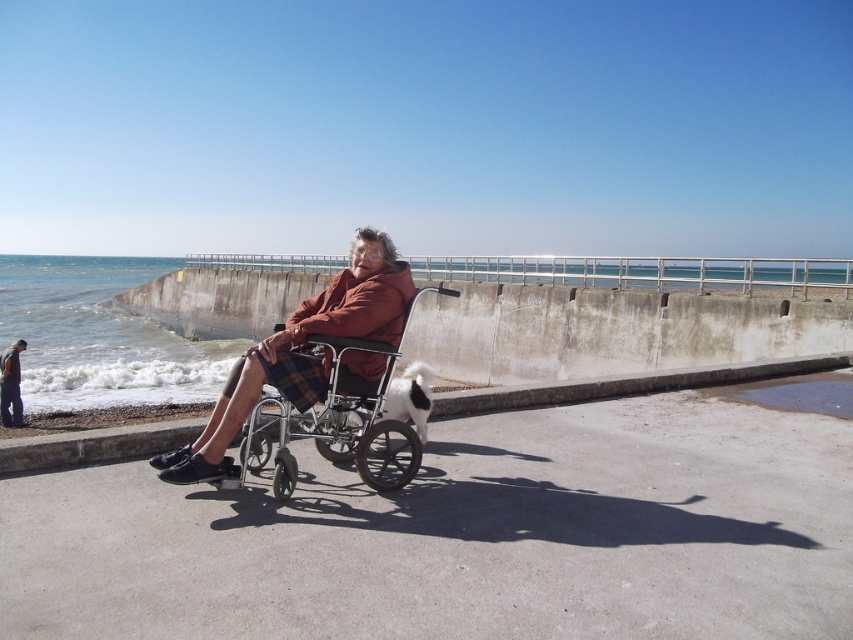
Who is positioned more to the left, metallic silver wheelchair at center or concrete at lower center?

From the viewer's perspective, metallic silver wheelchair at center appears more on the left side.

Which is in front, point (274, 476) or point (447, 404)?

Point (274, 476) is more forward.

Where is `metallic silver wheelchair at center`? The image size is (853, 640). metallic silver wheelchair at center is located at coordinates (335, 420).

Who is more distant from viewer, (x=49, y=602) or (x=347, y=406)?

The point (x=347, y=406) is behind.

Which is above, white sand at lower left or metallic silver wheelchair at center?

metallic silver wheelchair at center

What do you see at coordinates (463, 536) in the screenshot? The height and width of the screenshot is (640, 853). I see `white sand at lower left` at bounding box center [463, 536].

The image size is (853, 640). Identify the location of white sand at lower left. (463, 536).

Can you confirm if metallic silver wheelchair at center is wider than dark brown leather jacket at lower left?

Correct, the width of metallic silver wheelchair at center exceeds that of dark brown leather jacket at lower left.

Does metallic silver wheelchair at center have a lesser height compared to dark brown leather jacket at lower left?

No.

Does point (253, 412) come closer to viewer compared to point (9, 356)?

Yes, point (253, 412) is in front of point (9, 356).

This screenshot has width=853, height=640. I want to click on metallic silver wheelchair at center, so click(335, 420).